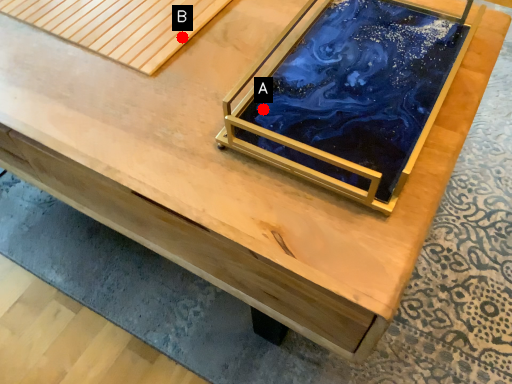
Question: Two points are circled on the image, labeled by A and B beside each circle. Which point is further to the camera?

Choices:
 (A) A is further
 (B) B is further

Answer: (B)